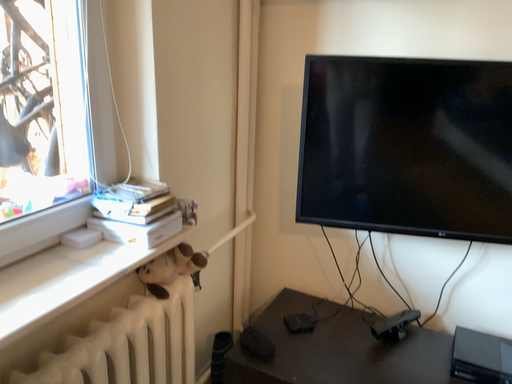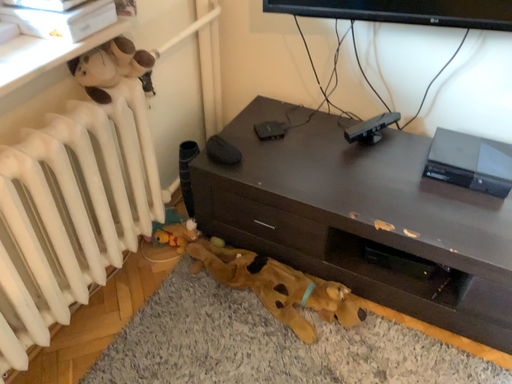
Question: How did the camera likely rotate when shooting the video?

Choices:
 (A) rotated downward
 (B) rotated upward

Answer: (A)